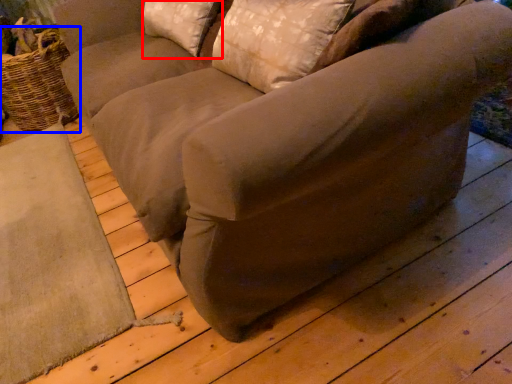
Question: Which of the following is the closest to the observer, pillow (highlighted by a red box) or basket (highlighted by a blue box)?

Choices:
 (A) pillow
 (B) basket

Answer: (A)